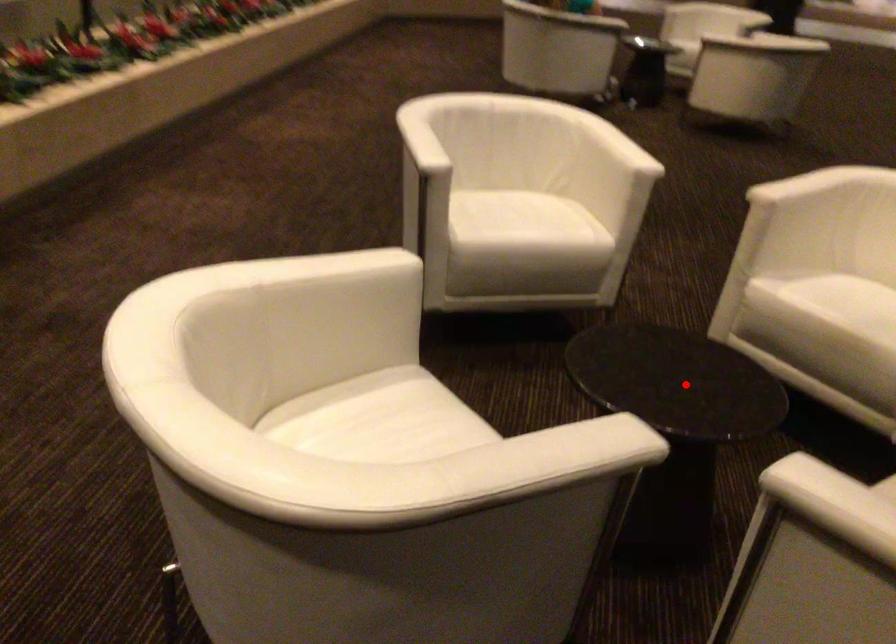
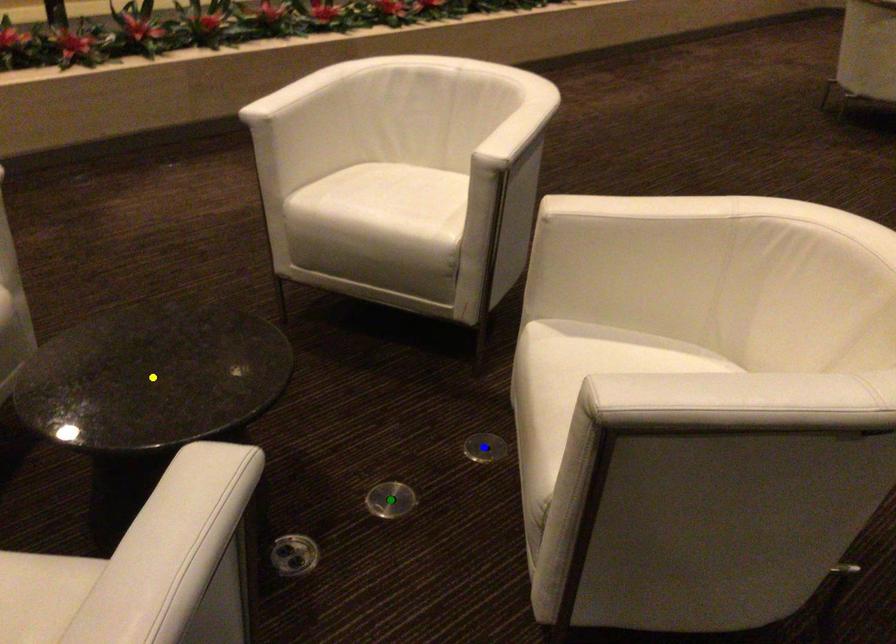
Question: I am providing you with two images of the same scene from different viewpoints. A red point is marked on the first image. You are given multiple points on the second image. Which point in image 2 is actually the same real-world point as the red point in image 1?

Choices:
 (A) green point
 (B) blue point
 (C) yellow point

Answer: (C)